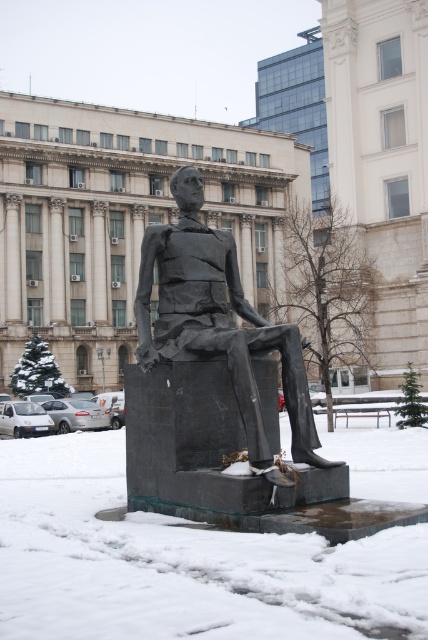
You are a GUI agent. You are given a task and a screenshot of the screen. Output one action in this format:
    pyautogui.click(x=<x>, y=<y>)
    Task: Click on the white frosty snow at lower center
    
    Given the screenshot: What is the action you would take?
    pyautogui.click(x=180, y=563)

Describe the element at coordinates (180, 563) in the screenshot. This screenshot has height=640, width=428. I see `white frosty snow at lower center` at that location.

Identify the location of white frosty snow at lower center. The width and height of the screenshot is (428, 640). (180, 563).